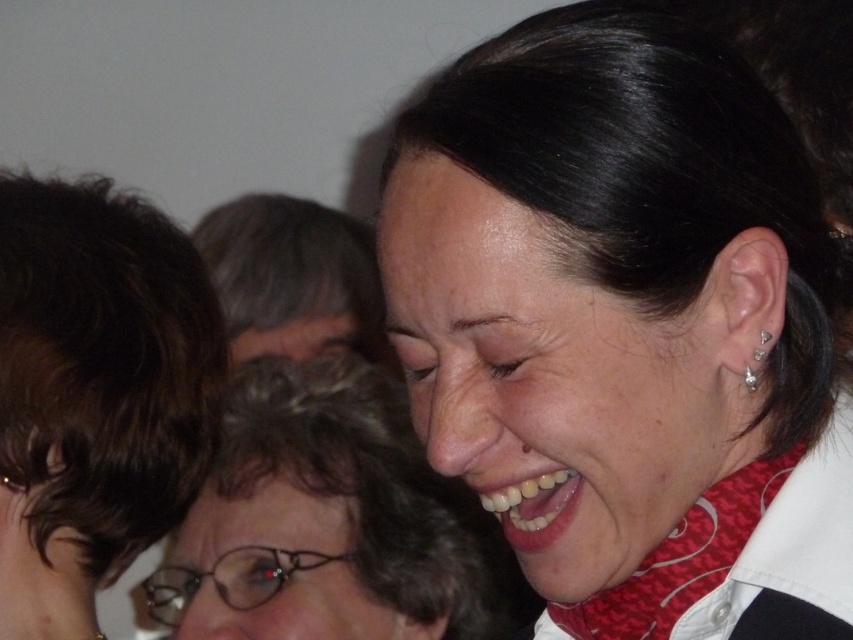
You are a photographer at a social event and want to capture a group photo of two people with matte black hair at upper right and matte black hair at upper center. The camera you are using has a minimum focusing distance of 24 inches. Will you be able to take a clear photo of both individuals without moving closer?

The two individuals with matte black hair at upper right and matte black hair at upper center are 23.20 inches apart. Since the minimum focusing distance of the camera is 24 inches, the camera cannot focus properly on both subjects simultaneously. You need to move slightly farther away or use a different camera with a shorter minimum focusing distance to ensure both are in focus.

You are at a party and see two people with matte black hair at upper right and matte black hair at upper center. Which one is positioned more to the right?

The matte black hair at upper right is positioned more to the right than the matte black hair at upper center.

You are a photographer adjusting your camera to focus on the subject. You notice the matte black hair at upper center and the silver metallic stud at ear. Which object is positioned to the right side of the other?

The silver metallic stud at ear is positioned to the right of the matte black hair at upper center because the matte black hair at upper center is to the left of the silver metallic stud at ear.